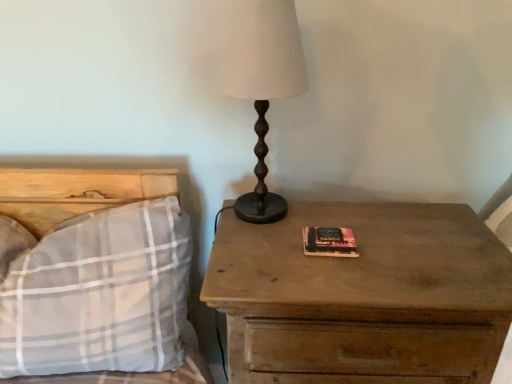
Question: Is plaid fabric pillow at left at the right side of matte brown table lamp at center?

Choices:
 (A) no
 (B) yes

Answer: (A)

Question: Is the depth of plaid fabric pillow at left greater than that of matte brown table lamp at center?

Choices:
 (A) no
 (B) yes

Answer: (A)

Question: Are plaid fabric pillow at left and matte brown table lamp at center located far from each other?

Choices:
 (A) no
 (B) yes

Answer: (A)

Question: Does plaid fabric pillow at left have a lesser height compared to matte brown table lamp at center?

Choices:
 (A) yes
 (B) no

Answer: (A)

Question: Is plaid fabric pillow at left thinner than matte brown table lamp at center?

Choices:
 (A) no
 (B) yes

Answer: (A)

Question: From the image's perspective, is wooden nightstand at right positioned above or below plaid fabric pillow at left?

Choices:
 (A) below
 (B) above

Answer: (A)

Question: In terms of size, does wooden nightstand at right appear bigger or smaller than plaid fabric pillow at left?

Choices:
 (A) small
 (B) big

Answer: (B)

Question: In terms of height, does wooden nightstand at right look taller or shorter compared to plaid fabric pillow at left?

Choices:
 (A) short
 (B) tall

Answer: (B)

Question: Would you say wooden nightstand at right is inside or outside plaid fabric pillow at left?

Choices:
 (A) outside
 (B) inside

Answer: (A)

Question: Is point (391, 259) closer or farther from the camera than point (291, 8)?

Choices:
 (A) closer
 (B) farther

Answer: (B)

Question: From their relative heights in the image, would you say wooden nightstand at right is taller or shorter than matte brown table lamp at center?

Choices:
 (A) short
 (B) tall

Answer: (B)

Question: Do you think wooden nightstand at right is within matte brown table lamp at center, or outside of it?

Choices:
 (A) outside
 (B) inside

Answer: (A)

Question: From a real-world perspective, relative to matte brown table lamp at center, is wooden nightstand at right vertically above or below?

Choices:
 (A) above
 (B) below

Answer: (B)

Question: Is matte brown table lamp at center inside or outside of wooden nightstand at right?

Choices:
 (A) inside
 (B) outside

Answer: (B)

Question: Is matte brown table lamp at center in front of or behind wooden nightstand at right in the image?

Choices:
 (A) behind
 (B) front

Answer: (A)